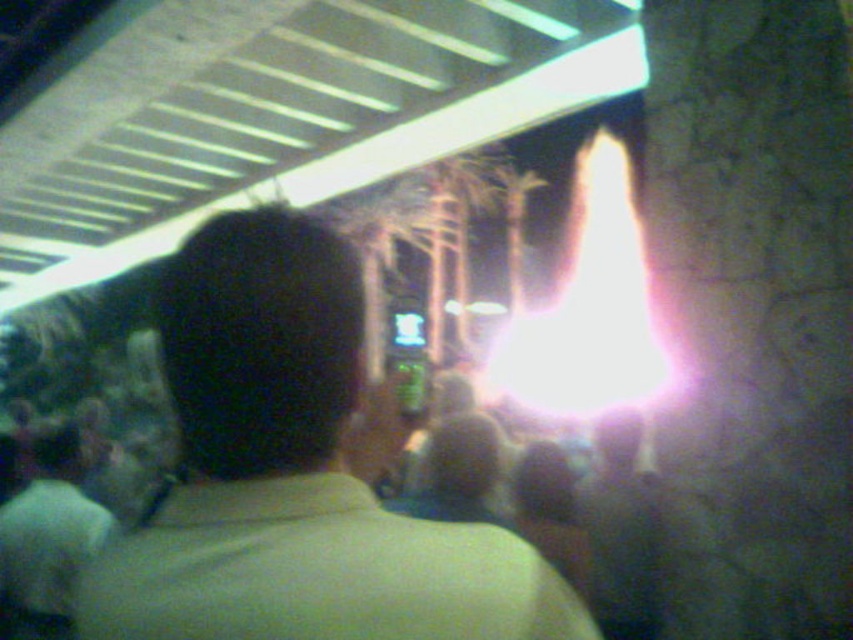
You are standing in the crowd at this event and want to see the stage clearly. There are two people in front of you wearing a light brown fabric shirt at center and a light green shirt at lower left. Which shirt should you look around to get a better view?

The light brown fabric shirt at center is closer to the viewer than the light green shirt at lower left, so you should look around the light brown fabric shirt at center to get a better view.

You are at a nighttime event and want to find the taller shirt between the light brown fabric shirt at center and the light green shirt at lower left. Which one should you look for?

The light green shirt at lower left is taller than the light brown fabric shirt at center.

You are standing at the point labeled point (201, 556) and want to move towards the point labeled point (53, 484). Given that you can only move forward in a straight line, will you get closer to the camera or farther away from it as you move?

As you move from point (201, 556) towards point (53, 484) in a straight line, you will be moving farther away from the camera because point (53, 484) is farther from the camera compared to point (201, 556).